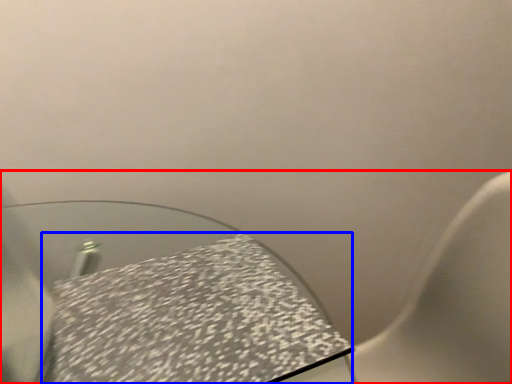
Question: Which object appears farthest to the camera in this image, toilet (highlighted by a red box) or tablecloth (highlighted by a blue box)?

Choices:
 (A) toilet
 (B) tablecloth

Answer: (B)